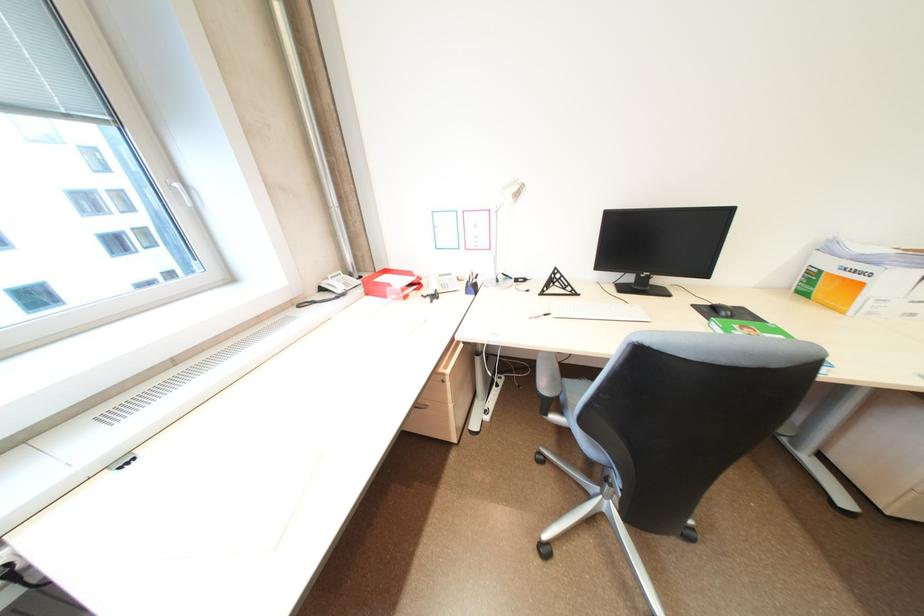
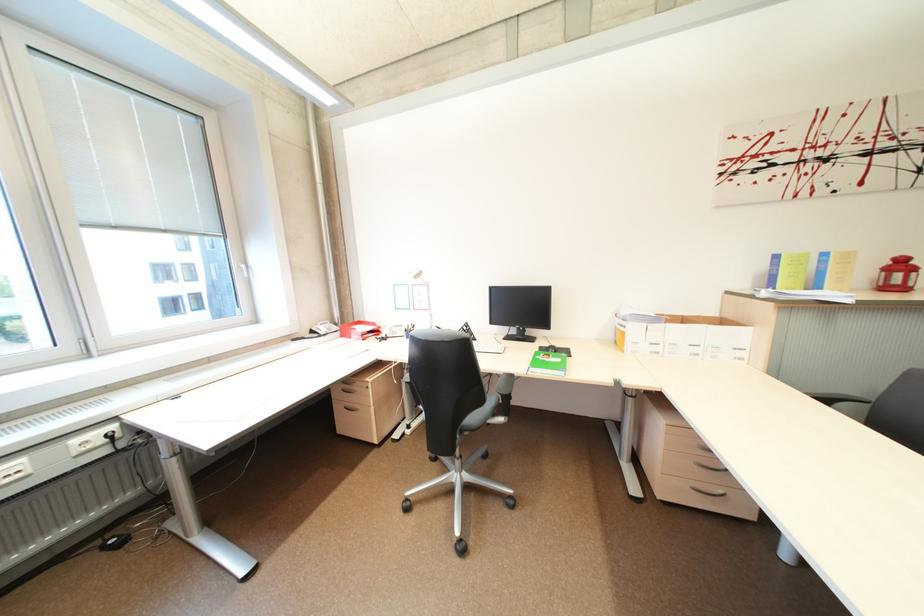
Where in the second image is the point corresponding to pixel 331 290 from the first image?

(321, 333)